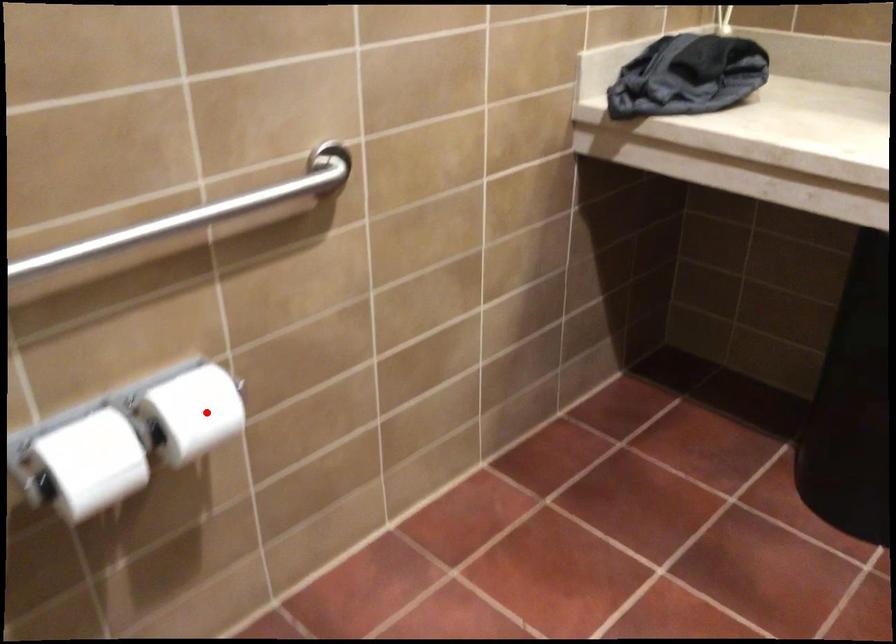
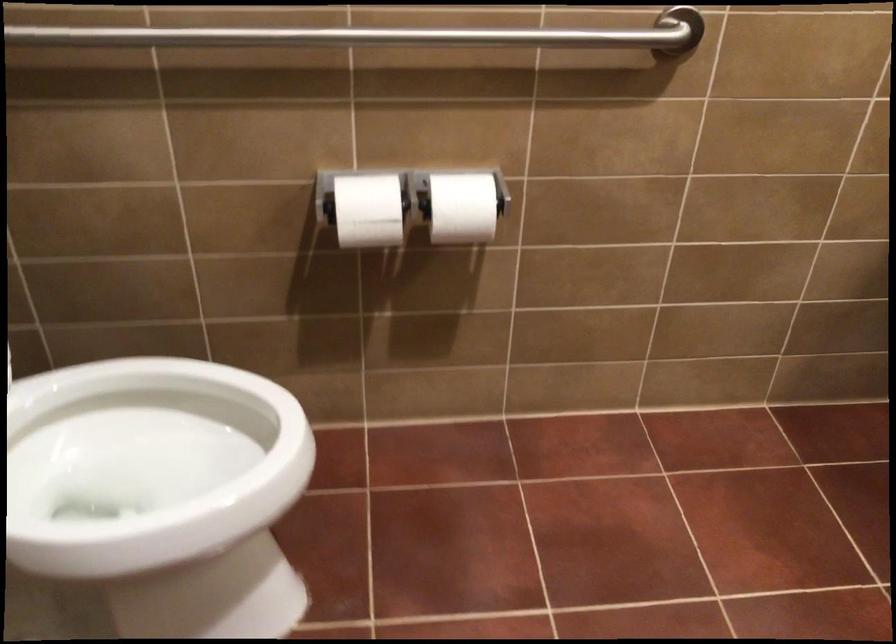
Question: I am providing you with two images of the same scene from different viewpoints. Given a red point in image1, look at the same physical point in image2. Is it:

Choices:
 (A) Closer to the viewpoint
 (B) Farther from the viewpoint

Answer: (B)